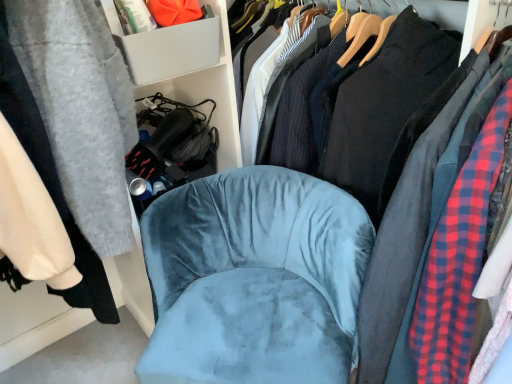
Question: Considering the relative positions of velvet blue chair at center and black cotton shirt at center in the image provided, is velvet blue chair at center to the left of black cotton shirt at center from the viewer's perspective?

Choices:
 (A) yes
 (B) no

Answer: (A)

Question: Is velvet blue chair at center positioned in front of black cotton shirt at center?

Choices:
 (A) no
 (B) yes

Answer: (A)

Question: Is the depth of velvet blue chair at center greater than that of black cotton shirt at center?

Choices:
 (A) no
 (B) yes

Answer: (B)

Question: Does velvet blue chair at center have a lesser height compared to black cotton shirt at center?

Choices:
 (A) no
 (B) yes

Answer: (B)

Question: From a real-world perspective, does velvet blue chair at center stand above black cotton shirt at center?

Choices:
 (A) no
 (B) yes

Answer: (A)

Question: Considering the relative sizes of velvet blue chair at center and black cotton shirt at center in the image provided, is velvet blue chair at center smaller than black cotton shirt at center?

Choices:
 (A) yes
 (B) no

Answer: (A)

Question: Is gray plastic storage bin at upper left looking in the opposite direction of velvet blue chair at center?

Choices:
 (A) yes
 (B) no

Answer: (B)

Question: Is gray plastic storage bin at upper left beside velvet blue chair at center?

Choices:
 (A) yes
 (B) no

Answer: (B)

Question: Does gray plastic storage bin at upper left contain velvet blue chair at center?

Choices:
 (A) no
 (B) yes

Answer: (A)

Question: Is gray plastic storage bin at upper left bigger than velvet blue chair at center?

Choices:
 (A) yes
 (B) no

Answer: (B)

Question: From a real-world perspective, is gray plastic storage bin at upper left on top of velvet blue chair at center?

Choices:
 (A) yes
 (B) no

Answer: (A)

Question: Considering the relative sizes of gray plastic storage bin at upper left and velvet blue chair at center in the image provided, is gray plastic storage bin at upper left wider than velvet blue chair at center?

Choices:
 (A) yes
 (B) no

Answer: (B)

Question: Can you confirm if black cotton shirt at center is shorter than gray plastic storage bin at upper left?

Choices:
 (A) no
 (B) yes

Answer: (A)